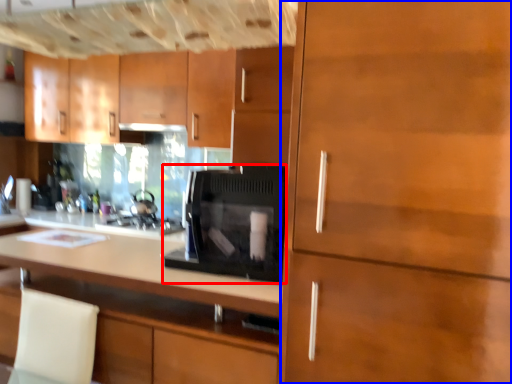
Question: Which object appears farthest to the camera in this image, home appliance (highlighted by a red box) or cabinetry (highlighted by a blue box)?

Choices:
 (A) home appliance
 (B) cabinetry

Answer: (A)